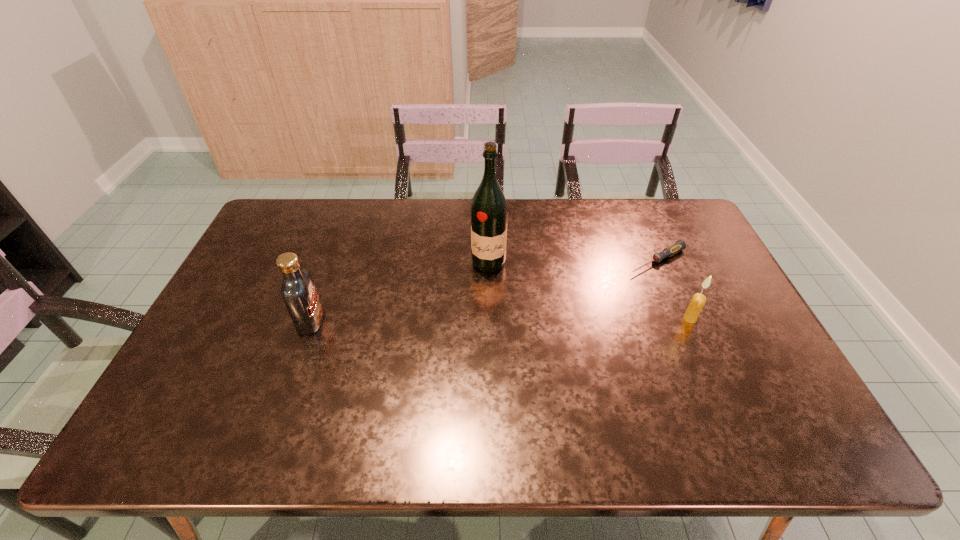
Identify the location of vodka. (298, 291).

Find the location of a particular element. The height and width of the screenshot is (540, 960). the third shortest object is located at coordinates (298, 291).

Find the location of a particular element. The image size is (960, 540). the second shortest object is located at coordinates (697, 302).

I want to click on the shortest object, so click(x=676, y=247).

This screenshot has height=540, width=960. I want to click on the third object from right to left, so click(x=489, y=214).

The width and height of the screenshot is (960, 540). I want to click on the tallest object, so click(x=489, y=214).

At what (x,y) coordinates should I click in order to perform the action: click on vacant space located 0.070m on the front-facing side of the leftmost object. Please return your answer as a coordinate pair (x, y). This screenshot has width=960, height=540. Looking at the image, I should click on point(348,321).

Locate an element on the screen. The width and height of the screenshot is (960, 540). free space located on the left of the third tallest object is located at coordinates coord(541,319).

Identify the location of blank area located insert the shortest object into a screw head. (583, 298).

Locate an element on the screen. This screenshot has width=960, height=540. vacant area located insert the shortest object into a screw head is located at coordinates click(x=572, y=303).